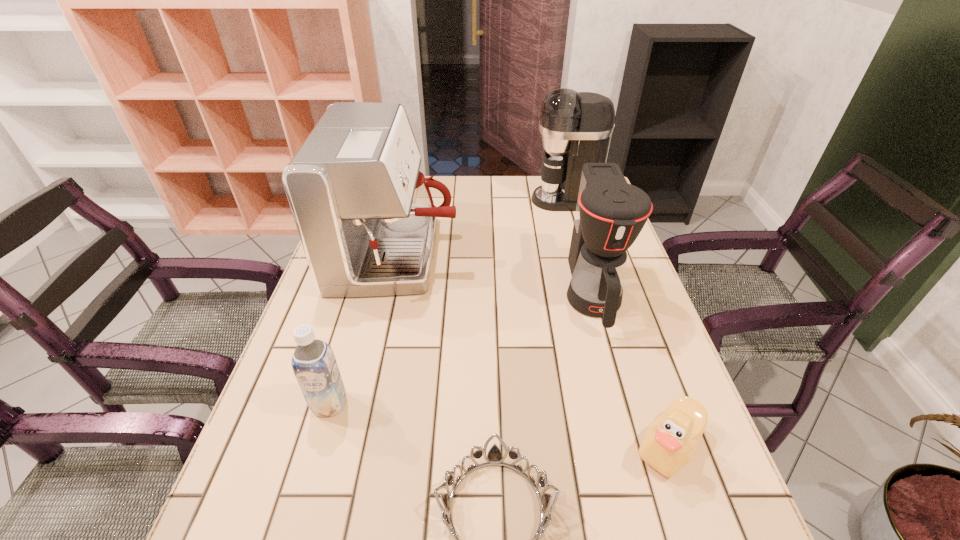
Where is `the leftmost coffee maker`? the leftmost coffee maker is located at coordinates click(365, 215).

Locate an element on the screen. The height and width of the screenshot is (540, 960). the farthest coffee maker is located at coordinates (576, 127).

Locate an element on the screen. The image size is (960, 540). the fourth shortest object is located at coordinates (610, 213).

At what (x,y) coordinates should I click in order to perform the action: click on soya milk. Please return your answer as a coordinate pair (x, y). The width and height of the screenshot is (960, 540). Looking at the image, I should click on (315, 368).

You are a GUI agent. You are given a task and a screenshot of the screen. Output one action in this format:
    pyautogui.click(x=<x>, y=<y>)
    Task: Click on the fifth tallest object
    Image resolution: width=960 pixels, height=540 pixels.
    Given the screenshot: What is the action you would take?
    pyautogui.click(x=670, y=442)

Identify the location of vacant space situated on the front of the leftmost coffee maker near the spout. (522, 255).

You are a GUI agent. You are given a task and a screenshot of the screen. Output one action in this format:
    pyautogui.click(x=<x>, y=<y>)
    Task: Click on the free space located 0.050m place cup under the spout of the farthest object
    
    Given the screenshot: What is the action you would take?
    pyautogui.click(x=516, y=200)

Image resolution: width=960 pixels, height=540 pixels. Find the location of `free space located place cup under the spout of the farthest object`. free space located place cup under the spout of the farthest object is located at coordinates (412, 200).

I want to click on free space located place cup under the spout of the farthest object, so click(463, 200).

Locate an element on the screen. free space located 0.230m pour from the carafe of the shortest coffee maker is located at coordinates (631, 431).